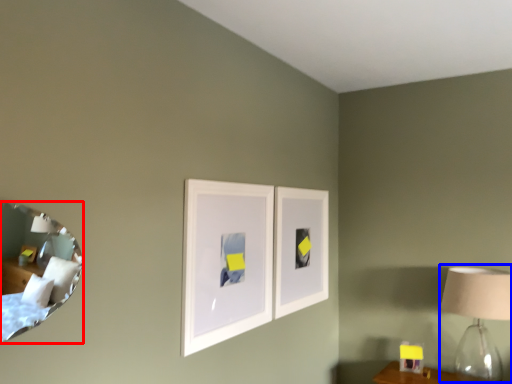
Question: Which object is closer to the camera taking this photo, mirror (highlighted by a red box) or table lamp (highlighted by a blue box)?

Choices:
 (A) mirror
 (B) table lamp

Answer: (A)